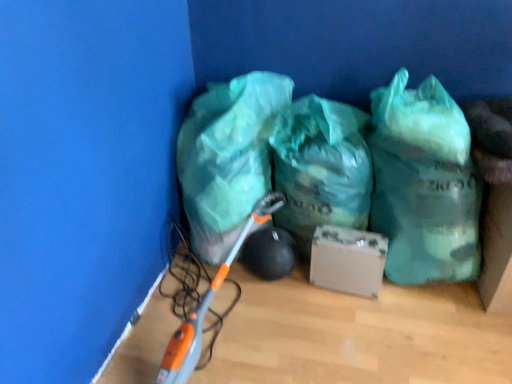
Question: Considering the positions of point (266, 105) and point (310, 183), is point (266, 105) closer or farther from the camera than point (310, 183)?

Choices:
 (A) closer
 (B) farther

Answer: (B)

Question: From their relative heights in the image, would you say translucent green plastic bag at lower left, the 3th plastic bag from the right, is taller or shorter than green translucent plastic bag at center, the second plastic bag viewed from the right?

Choices:
 (A) tall
 (B) short

Answer: (A)

Question: Which is nearer to the translucent green plastic bag at lower left, the 3th plastic bag from the right?

Choices:
 (A) green camouflage plastic bag at center, which ranks as the 1th plastic bag in right-to-left order
 (B) matte cardboard box at center
 (C) green translucent plastic bag at center, the second plastic bag viewed from the right

Answer: (C)

Question: Based on their relative distances, which object is nearer to the green translucent plastic bag at center, the second plastic bag viewed from the right?

Choices:
 (A) translucent green plastic bag at lower left, the 3th plastic bag from the right
 (B) matte cardboard box at center
 (C) green camouflage plastic bag at center, which is the third plastic bag from left to right

Answer: (B)